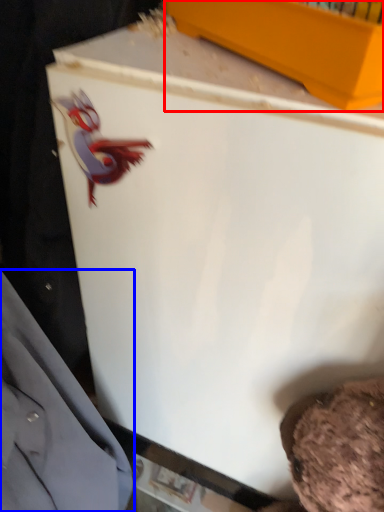
Question: Among these objects, which one is nearest to the camera, box (highlighted by a red box) or dress shirt (highlighted by a blue box)?

Choices:
 (A) box
 (B) dress shirt

Answer: (B)